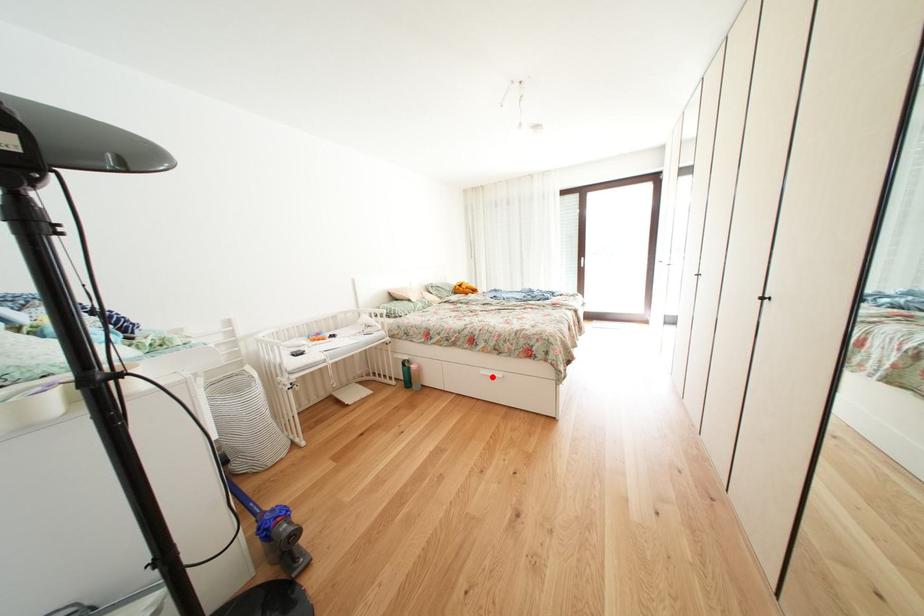
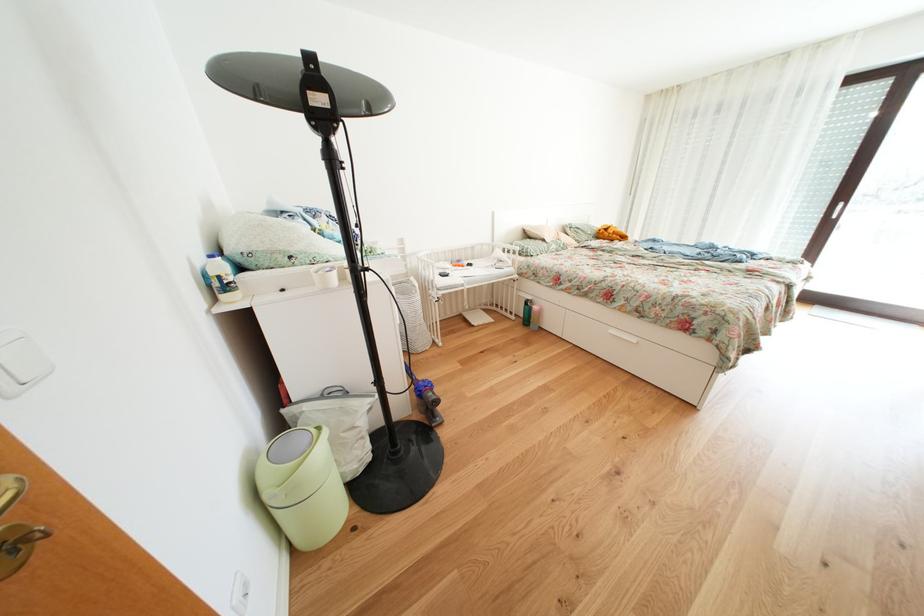
Locate, in the second image, the point that corresponds to the highlighted location in the first image.

(622, 336)